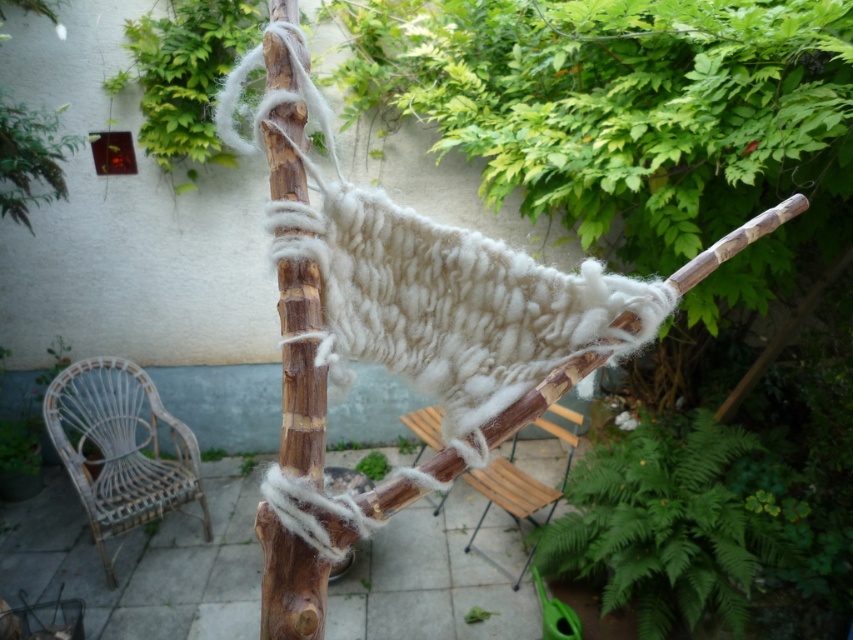
Question: Is white wicker chair at lower left to the left of wooden at center from the viewer's perspective?

Choices:
 (A) no
 (B) yes

Answer: (B)

Question: Which of these objects is positioned closest to the wooden at center?

Choices:
 (A) white wicker chair at lower left
 (B) wooden stick at center

Answer: (A)

Question: Which is farther from the white wicker chair at lower left?

Choices:
 (A) wooden stick at center
 (B) wooden at center

Answer: (A)

Question: From the image, what is the correct spatial relationship of wooden stick at center in relation to white wicker chair at lower left?

Choices:
 (A) left
 (B) right

Answer: (B)

Question: Can you confirm if white wicker chair at lower left is positioned to the right of wooden at center?

Choices:
 (A) no
 (B) yes

Answer: (A)

Question: Among these objects, which one is farthest from the camera?

Choices:
 (A) white wicker chair at lower left
 (B) wooden stick at center

Answer: (A)